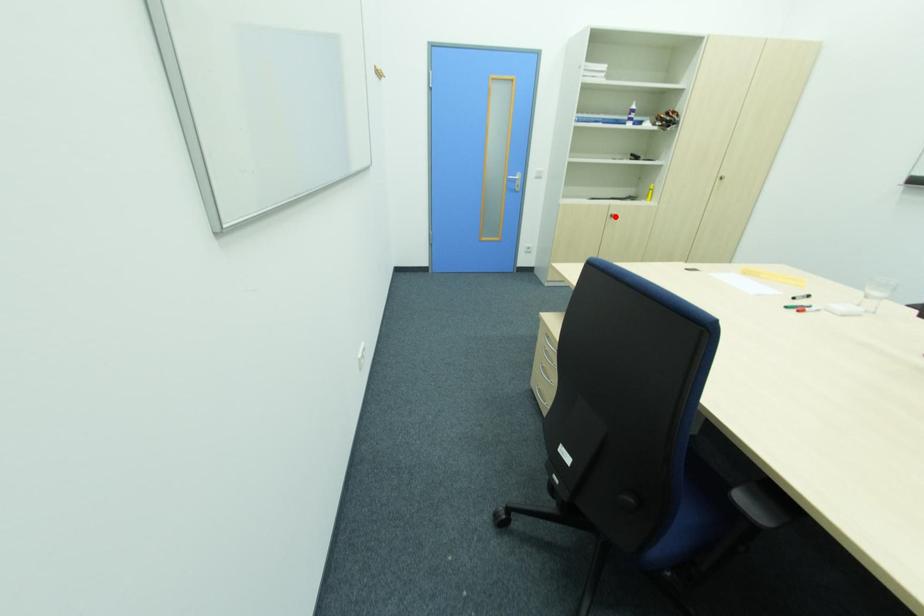
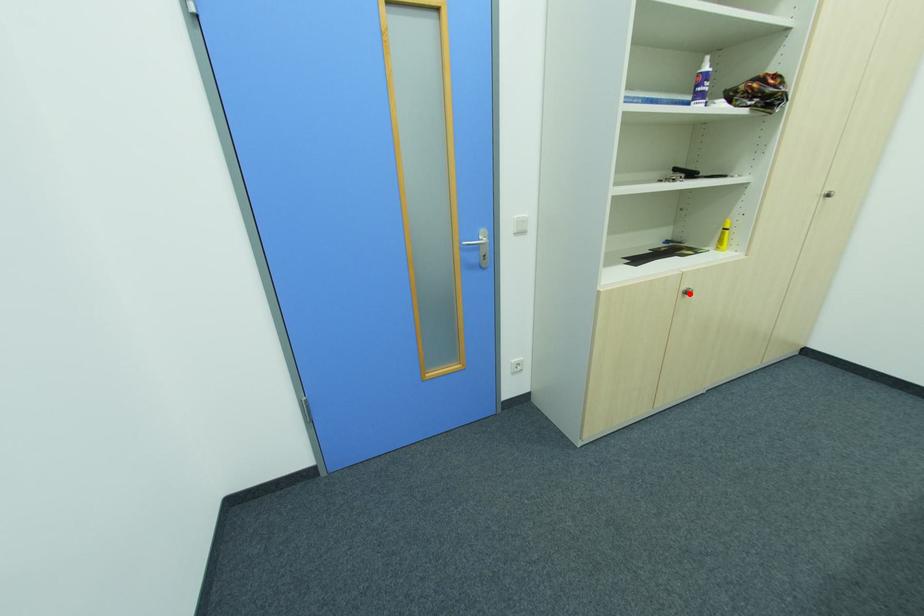
I am providing you with two images of the same scene from different viewpoints. A red point is marked on the first image and another point is marked on the second image. Does the point marked in image1 correspond to the same location as the one in image2?

Yes